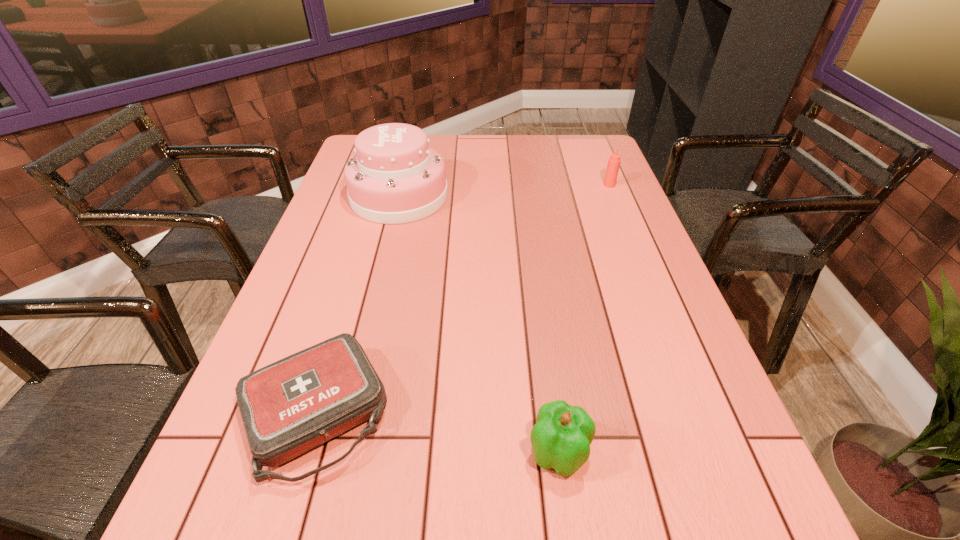
Find the location of a particular element. Image resolution: width=960 pixels, height=540 pixels. vacant region between the cake and the rightmost object is located at coordinates (504, 191).

Find the location of `free spot between the second object from right to left and the cake`. free spot between the second object from right to left and the cake is located at coordinates (479, 325).

The width and height of the screenshot is (960, 540). What are the coordinates of `free space between the Tabasco sauce and the second object from right to left` in the screenshot? It's located at (584, 319).

Find the location of a particular element. Image resolution: width=960 pixels, height=540 pixels. empty space that is in between the rightmost object and the tallest object is located at coordinates (504, 191).

Identify the location of empty space between the rightmost object and the third object from left to right. (584, 319).

This screenshot has height=540, width=960. Identify the location of free space between the bell pepper and the shortest object. (437, 433).

You are a GUI agent. You are given a task and a screenshot of the screen. Output one action in this format:
    pyautogui.click(x=<x>, y=<y>)
    Task: Click on the second closest object relative to the tallest object
    Image resolution: width=960 pixels, height=540 pixels.
    Given the screenshot: What is the action you would take?
    pyautogui.click(x=614, y=161)

You are a GUI agent. You are given a task and a screenshot of the screen. Output one action in this format:
    pyautogui.click(x=<x>, y=<y>)
    Task: Click on the object that stands as the second closest to the tallest object
    The image size is (960, 540).
    Given the screenshot: What is the action you would take?
    pyautogui.click(x=614, y=161)

At what (x,y) coordinates should I click in order to perform the action: click on blank space that satisfies the following two spatial constraints: 1. on the back side of the first-aid kit; 2. on the left side of the tallest object. Please return your answer as a coordinate pair (x, y). The height and width of the screenshot is (540, 960). Looking at the image, I should click on (381, 196).

Identify the location of free space that satisfies the following two spatial constraints: 1. on the back side of the shortest object; 2. on the left side of the tallest object. (381, 196).